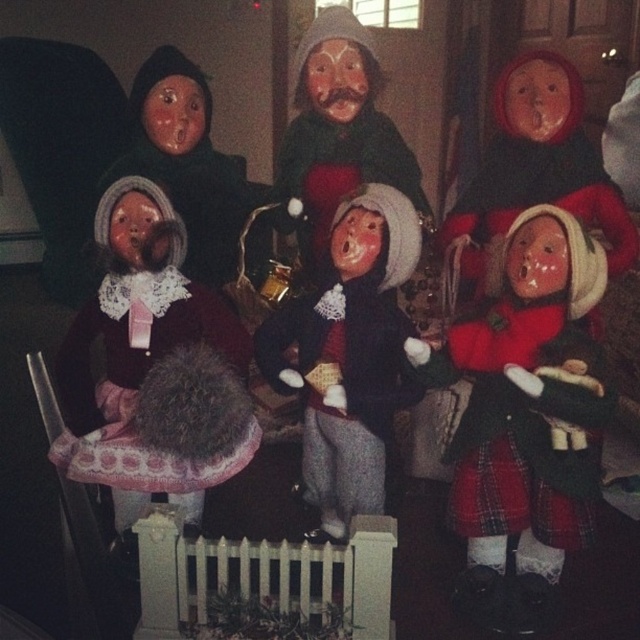
You are organizing a holiday display and want to place the red plaid skirt at center and the velvet maroon dress at left in a way that they are both visible. Given their sizes, which one should you place closer to the front to ensure both are visible?

The red plaid skirt at center is smaller in size compared to the velvet maroon dress at left, so placing the red plaid skirt at center closer to the front will ensure it is visible behind the larger velvet maroon dress at left.

You are a child who wants to touch the red plaid skirt at center. If you reach out your hand, which is 28 inches long from shoulder to fingertip, can you touch it without moving your feet?

The red plaid skirt at center is 39.20 inches away from the viewer. Since the child can only reach 28 inches from their shoulder, they cannot touch it without moving closer.

You are setting up a holiday display and want to ensure the red plaid skirt at center and the matte black doll at center are visible to guests. Since the display is on a shelf, which object should be placed in front to ensure both are visible?

The red plaid skirt at center is shorter than the matte black doll at center. To ensure both are visible, place the shorter red plaid skirt at center in front of the taller matte black doll at center.